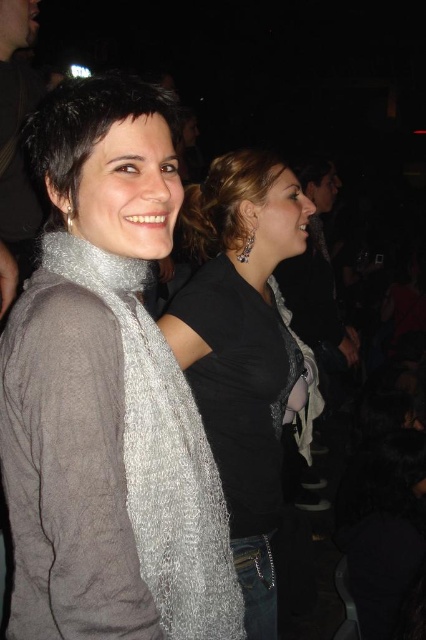
Question: Which object is the closest to the silver textured scarf at left?

Choices:
 (A) matte black hair at upper center
 (B) silver textured scarf at center
 (C) silver metallic scarf at left

Answer: (A)

Question: Which is nearer to the silver textured scarf at left?

Choices:
 (A) matte black hair at upper center
 (B) silver metallic scarf at left
 (C) silver textured scarf at center

Answer: (A)

Question: Does silver textured scarf at left have a smaller size compared to matte black hair at upper center?

Choices:
 (A) yes
 (B) no

Answer: (B)

Question: Is silver textured scarf at left smaller than matte black hair at upper center?

Choices:
 (A) no
 (B) yes

Answer: (A)

Question: Estimate the real-world distances between objects in this image. Which object is farther from the matte black hair at upper center?

Choices:
 (A) silver textured scarf at center
 (B) silver metallic scarf at left

Answer: (B)

Question: Does silver textured scarf at left come behind silver metallic scarf at left?

Choices:
 (A) yes
 (B) no

Answer: (B)